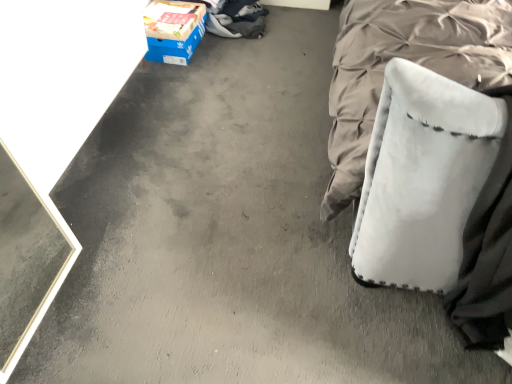
Question: Considering the positions of blue cardboard box at upper left and white fabric swivel chair at right in the image, is blue cardboard box at upper left taller or shorter than white fabric swivel chair at right?

Choices:
 (A) short
 (B) tall

Answer: (A)

Question: Is point (163, 26) positioned closer to the camera than point (375, 144)?

Choices:
 (A) closer
 (B) farther

Answer: (B)

Question: Is blue cardboard box at upper left wider or thinner than white fabric swivel chair at right?

Choices:
 (A) thin
 (B) wide

Answer: (A)

Question: Is white fabric swivel chair at right wider or thinner than blue cardboard box at upper left?

Choices:
 (A) wide
 (B) thin

Answer: (A)

Question: From a real-world perspective, relative to blue cardboard box at upper left, is white fabric swivel chair at right vertically above or below?

Choices:
 (A) below
 (B) above

Answer: (B)

Question: Considering the positions of white fabric swivel chair at right and blue cardboard box at upper left in the image, is white fabric swivel chair at right taller or shorter than blue cardboard box at upper left?

Choices:
 (A) short
 (B) tall

Answer: (B)

Question: Looking at the image, does white fabric swivel chair at right seem bigger or smaller compared to blue cardboard box at upper left?

Choices:
 (A) big
 (B) small

Answer: (A)